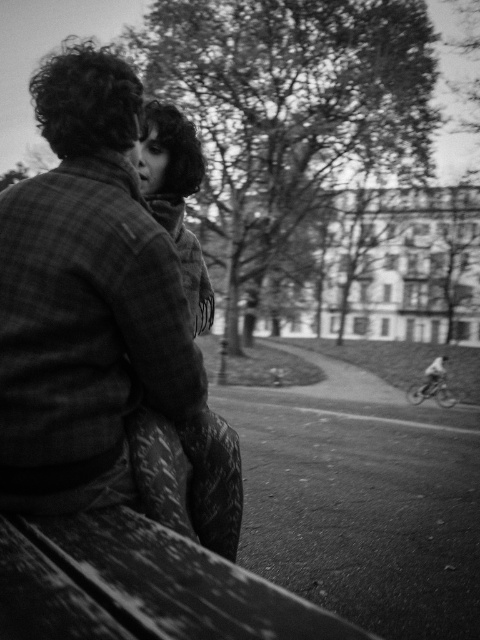
Question: Estimate the real-world distances between objects in this image. Which object is closer to the soft wool scarf at center?

Choices:
 (A) fluffy scarf at center
 (B) plaid wool coat at center

Answer: (A)

Question: Which is nearer to the plaid wool coat at center?

Choices:
 (A) fluffy scarf at center
 (B) soft wool scarf at center

Answer: (A)

Question: Can you confirm if plaid wool coat at center is wider than fluffy scarf at center?

Choices:
 (A) no
 (B) yes

Answer: (A)

Question: Observing the image, what is the correct spatial positioning of plaid wool coat at center in reference to fluffy scarf at center?

Choices:
 (A) right
 (B) left

Answer: (B)

Question: Does plaid wool coat at center lie behind soft wool scarf at center?

Choices:
 (A) yes
 (B) no

Answer: (A)

Question: Considering the real-world distances, which object is closest to the soft wool scarf at center?

Choices:
 (A) fluffy scarf at center
 (B) plaid wool coat at center

Answer: (A)